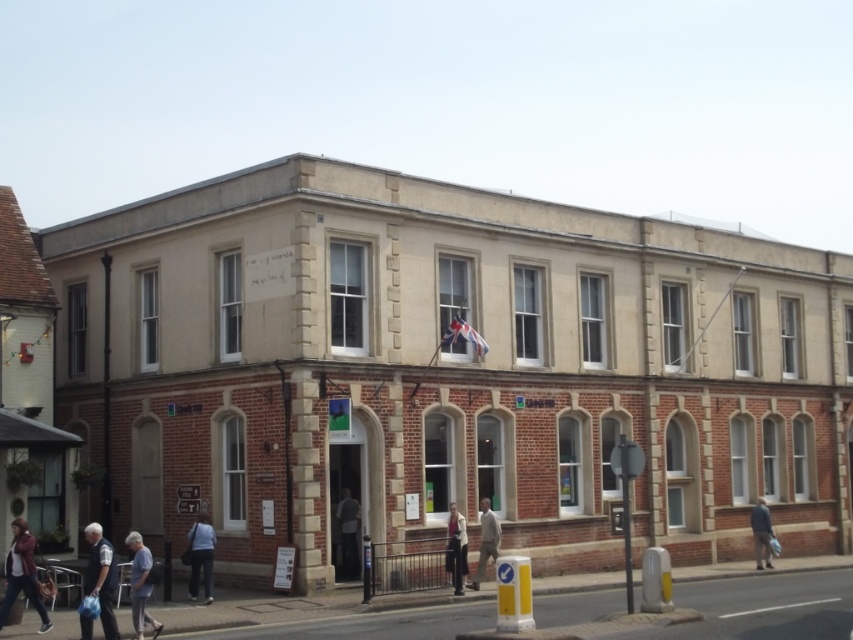
You are a delivery person standing at the entrance of the building. You need to leave a dark gray fabric jacket at center in a specific location. Where should you place it?

The dark gray fabric jacket at center should be placed at the coordinates point (347, 532).

You are standing at the entrance of the two story building and see a point marked at (102, 577). What object is located at that point?

The point marked at (102, 577) corresponds to the white cotton shirt at lower left.

You are standing at the entrance of the two story building and see a white cotton shirt at lower left and a denim jacket at lower left. Which one is closer to you?

The white cotton shirt at lower left is 3.32 meters away from the denim jacket at lower left, so the denim jacket at lower left is closer to you since it is only 3.32 meters away from the shirt which is further away.